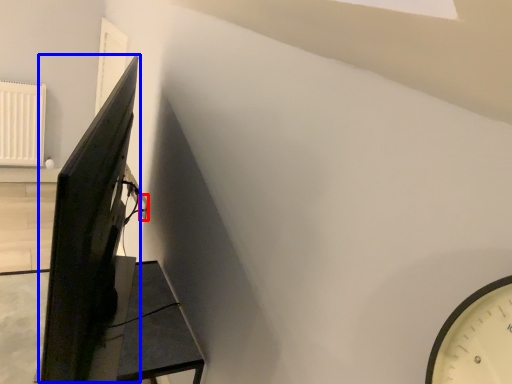
Question: Which object is further to the camera taking this photo, electric outlet (highlighted by a red box) or computer monitor (highlighted by a blue box)?

Choices:
 (A) electric outlet
 (B) computer monitor

Answer: (A)